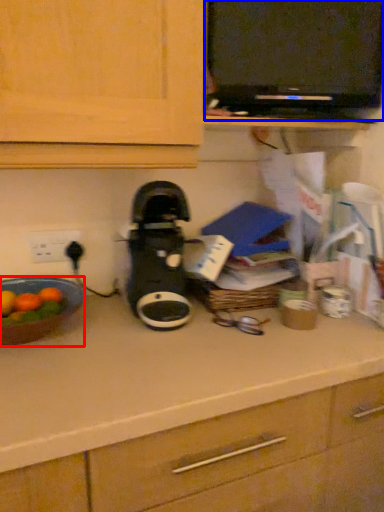
Question: Among these objects, which one is nearest to the camera, kitchen appliance (highlighted by a red box) or appliance (highlighted by a blue box)?

Choices:
 (A) kitchen appliance
 (B) appliance

Answer: (A)